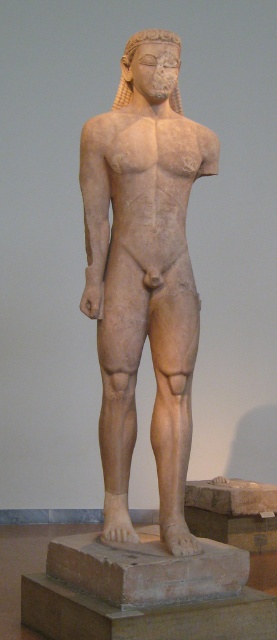
Question: Which point appears closest to the camera in this image?

Choices:
 (A) (183, 394)
 (B) (124, 598)

Answer: (B)

Question: Does beige stone statue at center appear on the right side of beige stone base at center?

Choices:
 (A) yes
 (B) no

Answer: (A)

Question: Which object appears closest to the camera in this image?

Choices:
 (A) beige stone statue at center
 (B) beige stone base at center

Answer: (B)

Question: Does beige stone statue at center appear on the left side of beige stone base at center?

Choices:
 (A) yes
 (B) no

Answer: (B)

Question: Does beige stone statue at center have a greater width compared to beige stone base at center?

Choices:
 (A) yes
 (B) no

Answer: (B)